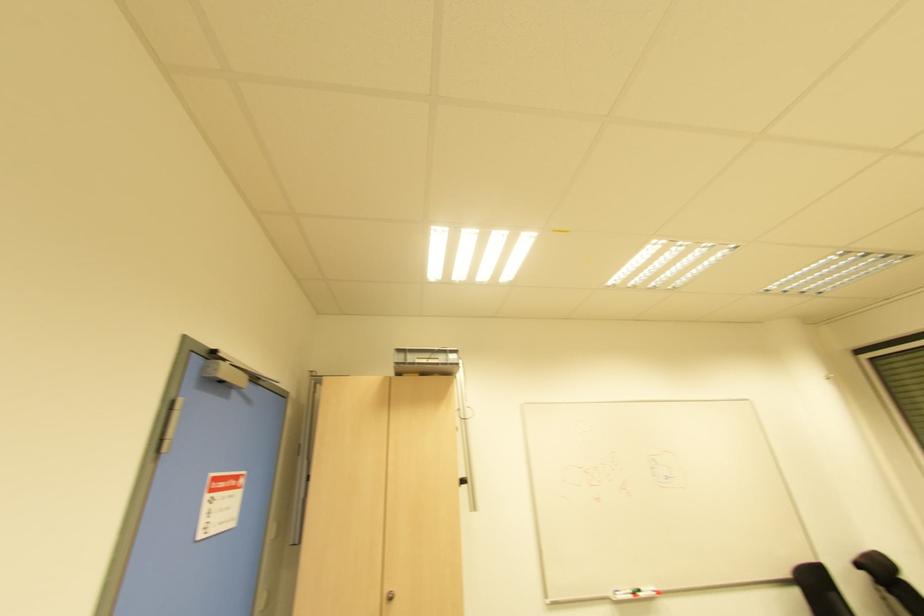
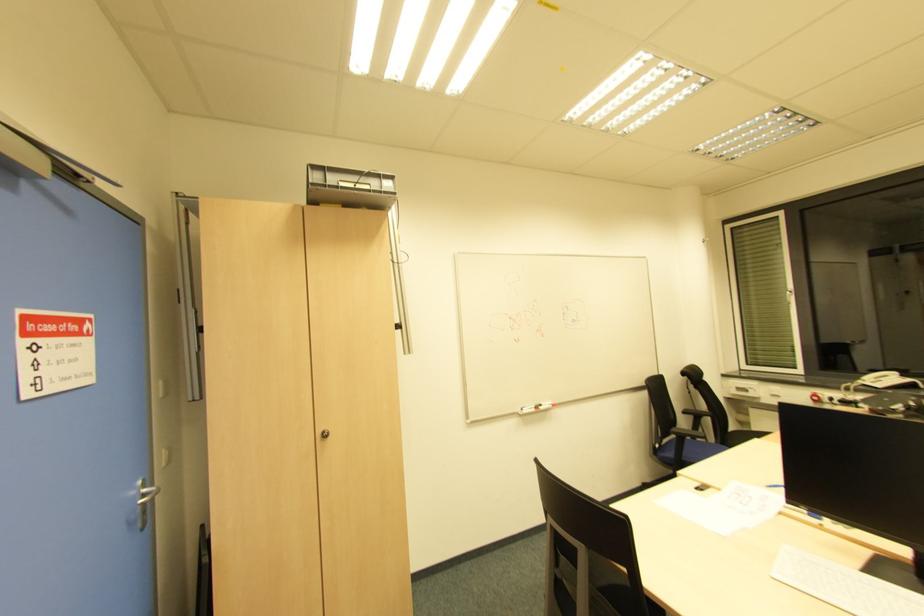
First-person continuous shooting, in which direction is the camera rotating?

The camera's rotation is toward right-down.